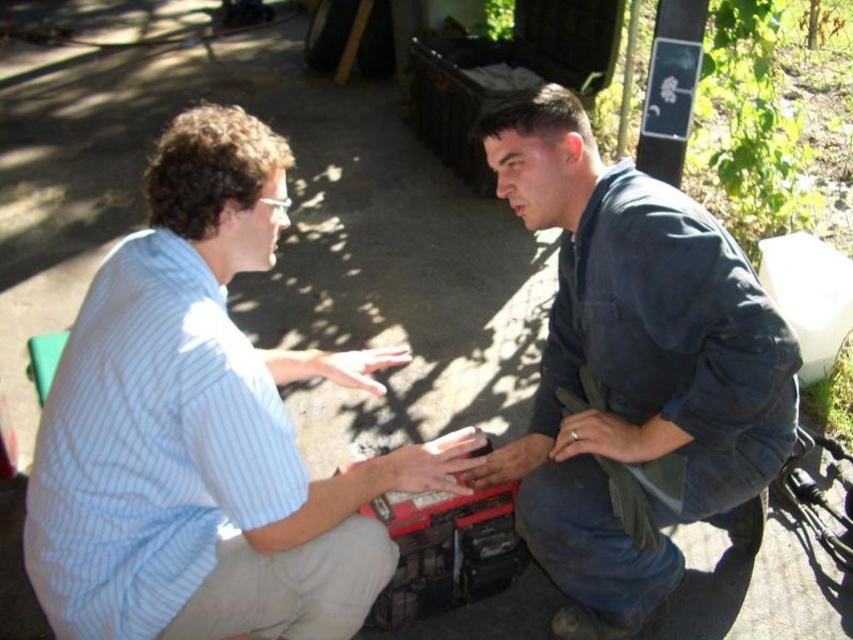
You are a delivery robot with a 1.2 meter wide package. You need to navigate through the space between the light blue striped shirt at center and the camera. Can your package fit through this space?

The distance between the light blue striped shirt at center and the camera is 1.17 meters, which is narrower than the 1.2 meter wide package. The package cannot fit through this space.

You are a photographer setting up a portrait shoot between the light blue striped shirt at center and the dark blue denim jeans at center. The minimum distance required between subjects for your camera to focus properly is 20 inches. Based on the scene, can you capture both subjects in focus without adjusting their positions?

The light blue striped shirt at center is 18.60 inches away from dark blue denim jeans at center. Since the minimum required distance is 20 inches, the subjects are too close, so the camera cannot focus properly without moving them farther apart.

You are standing in front of the two people in the image. Which clothing item, the light blue striped shirt at center or the dark blue denim jeans at center, would appear larger to you?

The light blue striped shirt at center appears larger because it is closer to the viewer than the dark blue denim jeans at center.